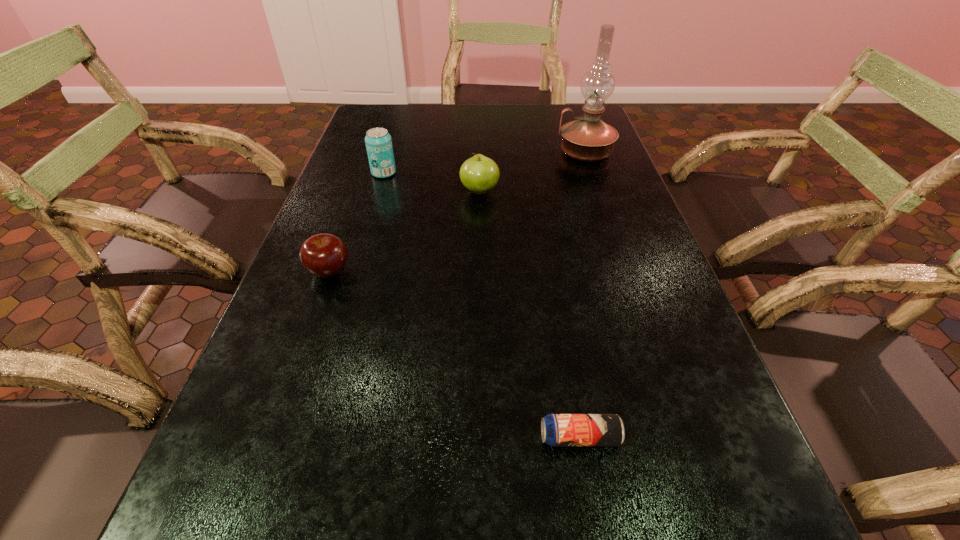
You are a GUI agent. You are given a task and a screenshot of the screen. Output one action in this format:
    pyautogui.click(x=<x>, y=<y>)
    Task: Click on the free region that satisfies the following two spatial constraints: 1. on the back side of the rightmost object; 2. on the right side of the fourth object from left to right
    
    Given the screenshot: What is the action you would take?
    pyautogui.click(x=531, y=152)